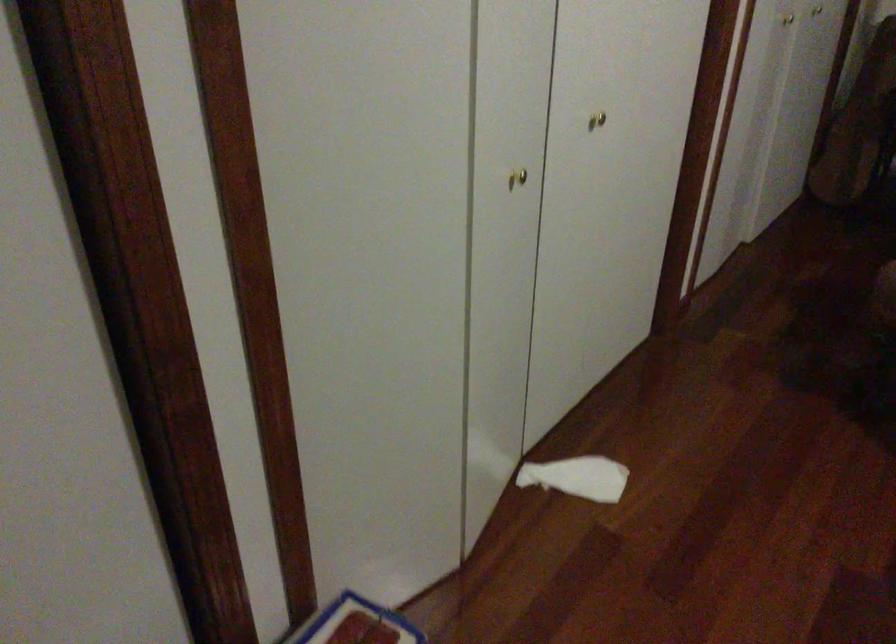
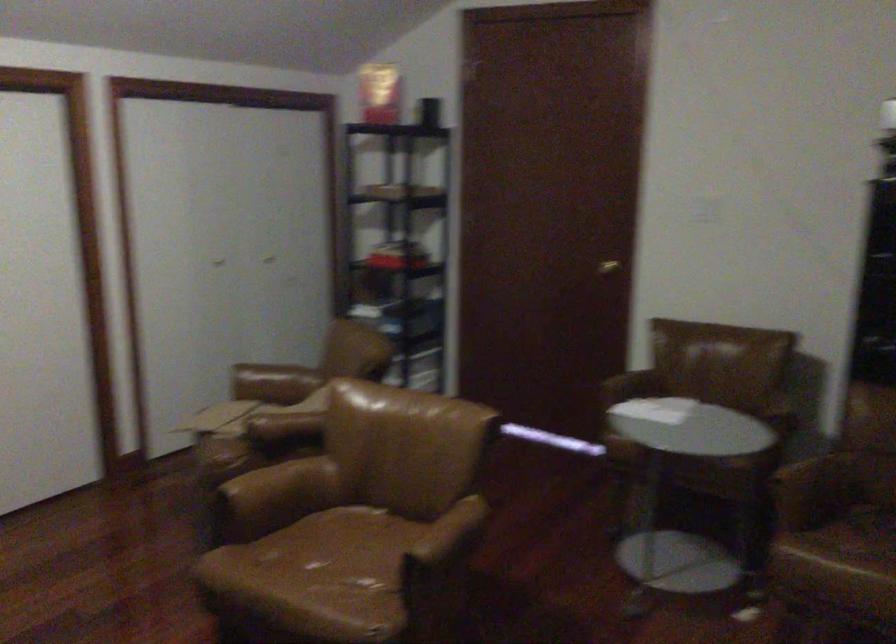
Which direction would the cameraman need to move to produce the second image?

The cameraman moved toward right, backward.